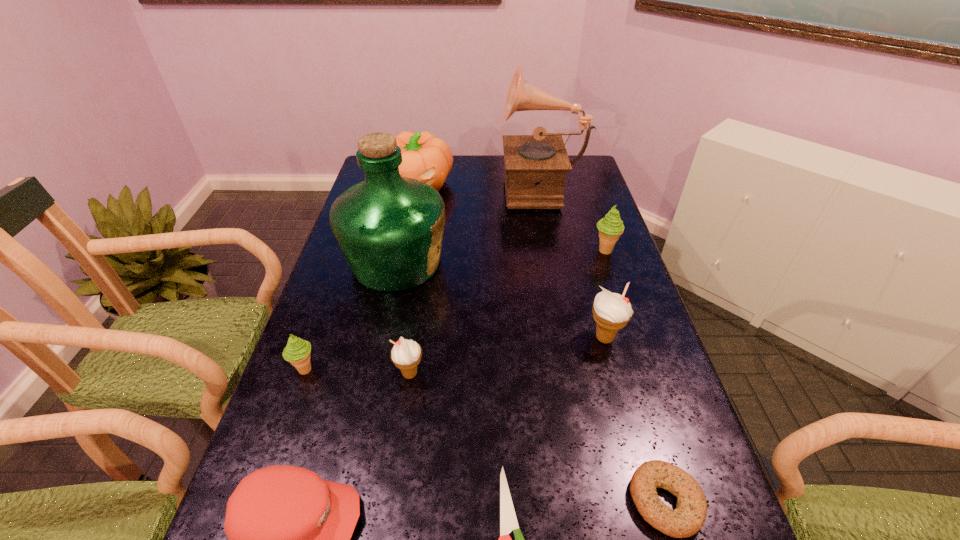
Find the location of a particular element. The height and width of the screenshot is (540, 960). record player positioned at the far edge is located at coordinates (535, 165).

Locate an element on the screen. pumpkin situated at the far edge is located at coordinates (426, 158).

Where is `liquor at the left edge`? liquor at the left edge is located at coordinates (389, 228).

What are the coordinates of `pumpkin at the left edge` in the screenshot? It's located at (426, 158).

You are a GUI agent. You are given a task and a screenshot of the screen. Output one action in this format:
    pyautogui.click(x=<x>, y=<y>)
    Task: Click on the icecream located at the left edge
    Image resolution: width=960 pixels, height=540 pixels.
    Given the screenshot: What is the action you would take?
    pyautogui.click(x=297, y=352)

Locate an element on the screen. The height and width of the screenshot is (540, 960). record player located at the right edge is located at coordinates (535, 165).

Identify the location of object at the far left corner. (426, 158).

Find the location of `object that is at the far right corner`. object that is at the far right corner is located at coordinates (535, 165).

This screenshot has height=540, width=960. Identify the location of blank area at the left edge. (330, 287).

You are a GUI agent. You are given a task and a screenshot of the screen. Output one action in this format:
    pyautogui.click(x=<x>, y=<y>)
    Task: Click on the vacant space at the right edge
    This screenshot has width=960, height=540.
    Given the screenshot: What is the action you would take?
    pyautogui.click(x=665, y=395)